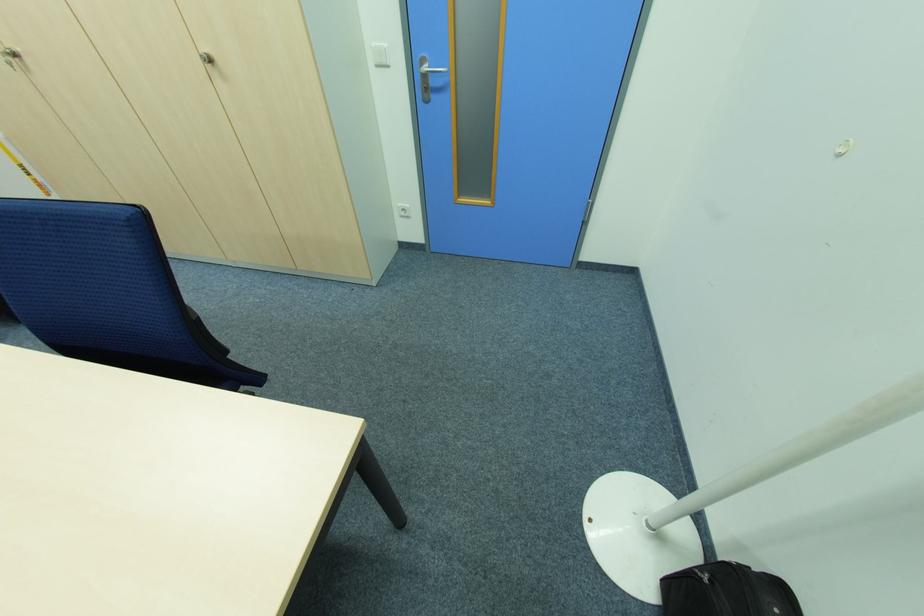
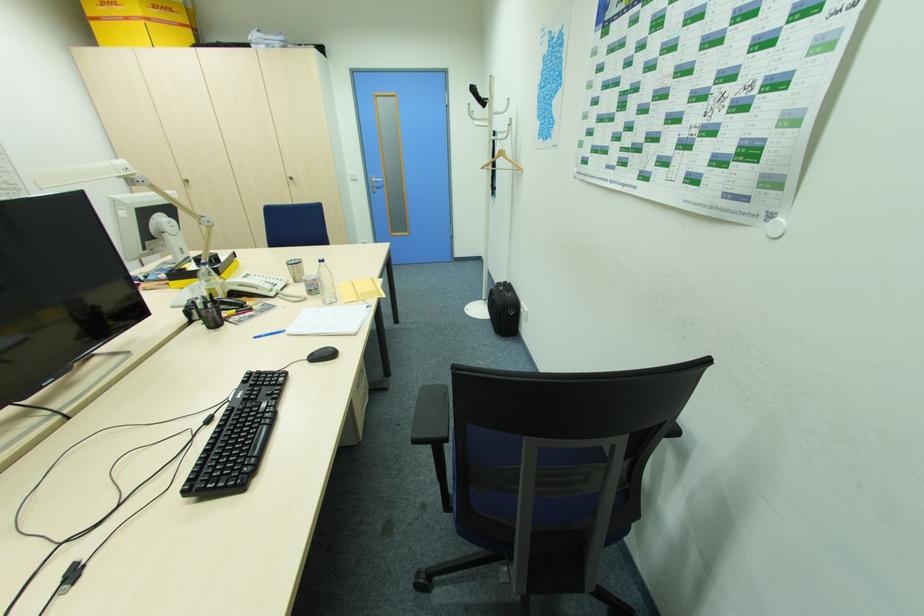
Where in the second image is the point corresponding to point 208,51 from the first image?

(292, 176)